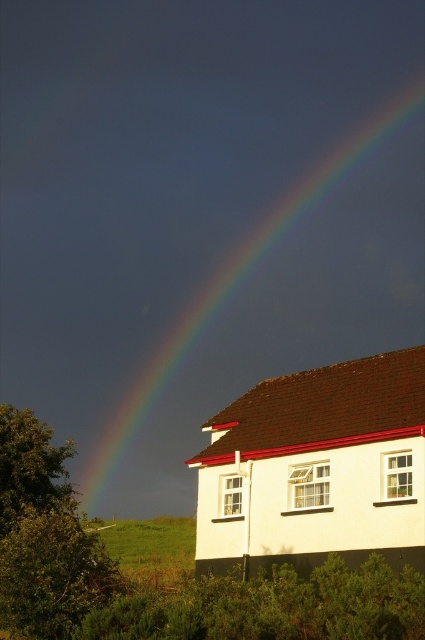
Question: Is rainbow at upper right in front of white painted wall at center?

Choices:
 (A) no
 (B) yes

Answer: (A)

Question: Considering the relative positions of rainbow at upper right and white painted wall at center in the image provided, where is rainbow at upper right located with respect to white painted wall at center?

Choices:
 (A) below
 (B) above

Answer: (B)

Question: Which point is farther to the camera?

Choices:
 (A) white painted wall at center
 (B) rainbow at upper right

Answer: (B)

Question: Is rainbow at upper right to the right of white painted wall at center from the viewer's perspective?

Choices:
 (A) no
 (B) yes

Answer: (A)

Question: Among these objects, which one is farthest from the camera?

Choices:
 (A) rainbow at upper right
 (B) white painted wall at center

Answer: (A)